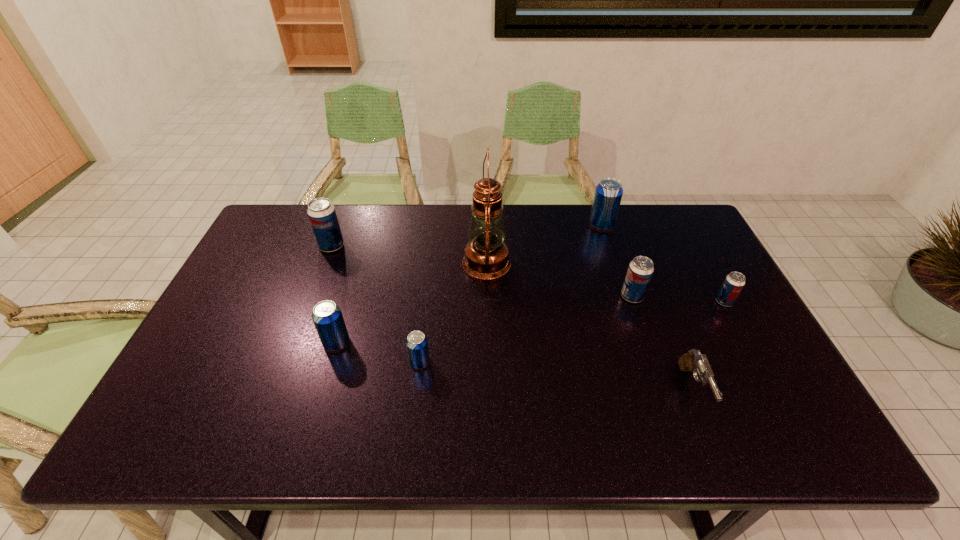
Locate an element on the screen. vacant area situated 0.310m on the left of the rightmost red beer can is located at coordinates (607, 302).

At what (x,y) coordinates should I click in order to perform the action: click on free space located 0.350m on the right of the sixth object from right to left. Please return your answer as a coordinate pair (x, y). The image size is (960, 540). Looking at the image, I should click on (569, 362).

This screenshot has height=540, width=960. I want to click on oil lamp located at the far edge, so click(486, 257).

Find the location of a particular element. object that is positioned at the near edge is located at coordinates (693, 361).

You are a GUI agent. You are given a task and a screenshot of the screen. Output one action in this format:
    pyautogui.click(x=<x>, y=<y>)
    Task: Click on the object present at the right edge
    
    Given the screenshot: What is the action you would take?
    pyautogui.click(x=734, y=282)

Image resolution: width=960 pixels, height=540 pixels. In the image, there is a desktop. In order to click on free region at the far edge in this screenshot , I will do `click(640, 214)`.

Identify the location of free region at the near edge. Image resolution: width=960 pixels, height=540 pixels. (692, 438).

Where is `vacant space at the left edge`? vacant space at the left edge is located at coordinates (276, 249).

The width and height of the screenshot is (960, 540). Find the location of `unoccupied position between the fifth object from right to left and the pistol`. unoccupied position between the fifth object from right to left and the pistol is located at coordinates (589, 326).

Identify the location of free space between the pistol and the farthest beer can. (647, 307).